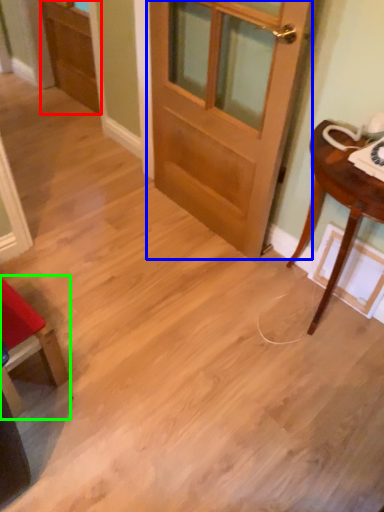
Question: Which object is positioned farthest from screen door (highlighted by a red box)? Select from door (highlighted by a blue box) and chair (highlighted by a green box).

Choices:
 (A) door
 (B) chair

Answer: (B)